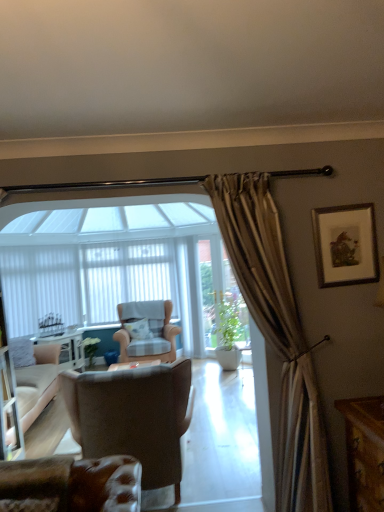
What do you see at coordinates (90, 349) in the screenshot? This screenshot has width=384, height=512. I see `white glossy vase at center, positioned as the first plant in back-to-front order` at bounding box center [90, 349].

I want to click on brown leather chair at center, which ranks as the second chair in back-to-front order, so tap(134, 417).

How much space does green glossy plant at center, arranged as the 1th plant when viewed from the front, occupy vertically?

green glossy plant at center, arranged as the 1th plant when viewed from the front, is 98.96 centimeters tall.

Measure the distance between point (149, 358) and camera.

Point (149, 358) is 15.85 feet from camera.

This screenshot has width=384, height=512. I want to click on white glossy vase at center, the 2th plant from the right, so click(90, 349).

Is white fabric curtain at left positioned before white textured pillow at center?

Yes, white fabric curtain at left is in front of white textured pillow at center.

Is white fabric curtain at left bigger than white textured pillow at center?

Yes, white fabric curtain at left is bigger than white textured pillow at center.

Is white fabric curtain at left in contact with white textured pillow at center?

white fabric curtain at left and white textured pillow at center are not in contact.

How distant is white textured pillow at center from wooden framed print at upper right?

A distance of 3.05 meters exists between white textured pillow at center and wooden framed print at upper right.

Looking at this image, can you confirm if white textured pillow at center is wider than wooden framed print at upper right?

Indeed, white textured pillow at center has a greater width compared to wooden framed print at upper right.

Between point (137, 325) and point (352, 219), which one is positioned behind?

Point (137, 325)

From the image's perspective, is white textured pillow at center beneath wooden framed print at upper right?

Yes, from the image's perspective, white textured pillow at center is beneath wooden framed print at upper right.

Relative to wooden framed print at upper right, is leather at lower left, placed as the third chair when sorted from back to front, in front or behind?

Visually, leather at lower left, placed as the third chair when sorted from back to front, is located in front of wooden framed print at upper right.

How many degrees apart are the facing directions of leather at lower left, placed as the third chair when sorted from back to front, and wooden framed print at upper right?

They differ by 0.825 degrees in their facing directions.

Can you confirm if leather at lower left, the first chair when ordered from front to back, is positioned to the left of wooden framed print at upper right?

Indeed, leather at lower left, the first chair when ordered from front to back, is positioned on the left side of wooden framed print at upper right.

Between leather at lower left, the first chair when ordered from front to back, and wooden framed print at upper right, which one has larger width?

leather at lower left, the first chair when ordered from front to back, is wider.

Measure the distance between white glossy vase at center, the 2th plant from the right, and brown leather chair at center, which ranks as the second chair in back-to-front order.

They are 7.21 feet apart.

Does white glossy vase at center, the 1th plant in the left-to-right sequence, touch brown leather chair at center, placed as the second chair when sorted from front to back?

white glossy vase at center, the 1th plant in the left-to-right sequence, and brown leather chair at center, placed as the second chair when sorted from front to back, are clearly separated.

Considering the positions of points (90, 368) and (154, 484), is point (90, 368) closer to camera compared to point (154, 484)?

No.

From a real-world perspective, relative to brown leather chair at center, which ranks as the second chair in back-to-front order, is white glossy vase at center, positioned as the first plant in back-to-front order, vertically above or below?

In terms of real-world spatial position, white glossy vase at center, positioned as the first plant in back-to-front order, is below brown leather chair at center, which ranks as the second chair in back-to-front order.

What's the angular difference between wooden framed print at upper right and white vertical blinds at center's facing directions?

0.46 degrees separate the facing orientations of wooden framed print at upper right and white vertical blinds at center.

Is wooden framed print at upper right looking in the opposite direction of white vertical blinds at center?

Yes.

Do you think wooden framed print at upper right is within white vertical blinds at center, or outside of it?

wooden framed print at upper right is located beyond the bounds of white vertical blinds at center.

Could you tell me if leather at lower left, the first chair when ordered from front to back, is facing white glossy vase at center, positioned as the first plant in back-to-front order?

No, leather at lower left, the first chair when ordered from front to back, does not turn towards white glossy vase at center, positioned as the first plant in back-to-front order.

Is point (102, 489) positioned in front of point (86, 345)?

Yes, point (102, 489) is closer to viewer.

From a real-world perspective, is leather at lower left, placed as the third chair when sorted from back to front, positioned above or below white glossy vase at center, the 1th plant in the left-to-right sequence?

In terms of real-world spatial position, leather at lower left, placed as the third chair when sorted from back to front, is above white glossy vase at center, the 1th plant in the left-to-right sequence.

Considering the sizes of leather at lower left, placed as the third chair when sorted from back to front, and white vertical blinds at center in the image, is leather at lower left, placed as the third chair when sorted from back to front, taller or shorter than white vertical blinds at center?

leather at lower left, placed as the third chair when sorted from back to front, is shorter than white vertical blinds at center.

Considering the relative positions of leather at lower left, placed as the third chair when sorted from back to front, and white vertical blinds at center in the image provided, is leather at lower left, placed as the third chair when sorted from back to front, to the left of white vertical blinds at center from the viewer's perspective?

Incorrect, leather at lower left, placed as the third chair when sorted from back to front, is not on the left side of white vertical blinds at center.

Looking at their sizes, would you say leather at lower left, placed as the third chair when sorted from back to front, is wider or thinner than white vertical blinds at center?

leather at lower left, placed as the third chair when sorted from back to front, is wider than white vertical blinds at center.

From a real-world perspective, is leather at lower left, the first chair when ordered from front to back, above or below white vertical blinds at center?

leather at lower left, the first chair when ordered from front to back, is below white vertical blinds at center.

Where is `pillow behind the white fabric curtain at left`? The image size is (384, 512). pillow behind the white fabric curtain at left is located at coordinates (138, 329).

Where is `picture frame lying above the white textured pillow at center (from the image's perspective)`? The height and width of the screenshot is (512, 384). picture frame lying above the white textured pillow at center (from the image's perspective) is located at coordinates (345, 245).

Estimate the real-world distances between objects in this image. Which object is closer to white glossy vase at center, the 1th plant in the left-to-right sequence, checkered fabric armchair at center, which is counted as the third chair, starting from the front, or white vertical blinds at center?

The object closer to white glossy vase at center, the 1th plant in the left-to-right sequence, is checkered fabric armchair at center, which is counted as the third chair, starting from the front.

Based on their spatial positions, is green glossy plant at center, arranged as the 1th plant when viewed from the front, or leather at lower left, the first chair when ordered from front to back, further from white glossy vase at center, the second plant from the front?

leather at lower left, the first chair when ordered from front to back.

From the image, which object appears to be farther from white glossy vase at center, positioned as the first plant in back-to-front order, wooden framed print at upper right or green glossy plant at center, which ranks as the 2th plant in back-to-front order?

Among the two, wooden framed print at upper right is located further to white glossy vase at center, positioned as the first plant in back-to-front order.

Estimate the real-world distances between objects in this image. Which object is closer to green glossy plant at center, which ranks as the 2th plant in back-to-front order, white fabric curtain at left or wooden framed print at upper right?

white fabric curtain at left is closer to green glossy plant at center, which ranks as the 2th plant in back-to-front order.

When comparing their distances from brown leather chair at center, placed as the second chair when sorted from front to back, does checkered fabric armchair at center, the first chair from the back, or green glossy plant at center, which is the first plant in right-to-left order, seem closer?

checkered fabric armchair at center, the first chair from the back.

Estimate the real-world distances between objects in this image. Which object is further from green glossy plant at center, arranged as the 1th plant when viewed from the front, checkered fabric armchair at center, the first chair from the back, or white fabric curtain at left?

white fabric curtain at left is further to green glossy plant at center, arranged as the 1th plant when viewed from the front.

From the image, which object appears to be farther from leather at lower left, the first chair when ordered from front to back, wooden framed print at upper right or white fabric curtain at left?

The object further to leather at lower left, the first chair when ordered from front to back, is white fabric curtain at left.

Estimate the real-world distances between objects in this image. Which object is further from checkered fabric armchair at center, which is counted as the third chair, starting from the front, brown leather chair at center, which ranks as the second chair in back-to-front order, or white vertical blinds at center?

brown leather chair at center, which ranks as the second chair in back-to-front order, lies further to checkered fabric armchair at center, which is counted as the third chair, starting from the front, than the other object.

Locate an element on the screen. The image size is (384, 512). plant between white fabric curtain at left and green glossy plant at center, which is the first plant in right-to-left order is located at coordinates (90, 349).

Find the location of a particular element. The width and height of the screenshot is (384, 512). chair between brown leather chair at center, which ranks as the second chair in back-to-front order, and green glossy plant at center, which ranks as the 2th plant in back-to-front order, in the front-back direction is located at coordinates 147,331.

Locate an element on the screen. pillow located between brown leather chair at center, which ranks as the second chair in back-to-front order, and white vertical blinds at center in the depth direction is located at coordinates (138, 329).

Identify the location of window between white fabric curtain at left and white textured pillow at center from left to right. The width and height of the screenshot is (384, 512). (126, 277).